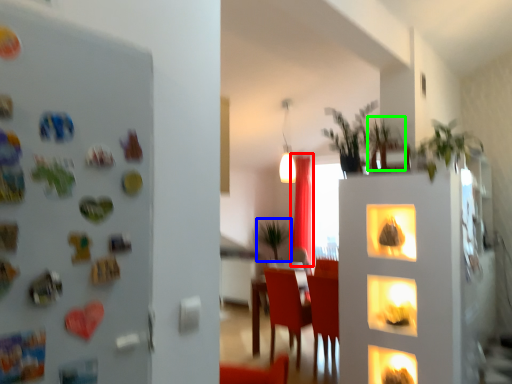
Question: Based on their relative distances, which object is nearer to curtain (highlighted by a red box)? Choose from plant (highlighted by a blue box) and plant (highlighted by a green box).

Choices:
 (A) plant
 (B) plant

Answer: (A)